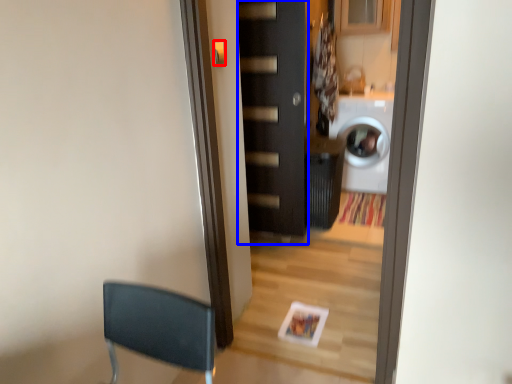
Question: Which point is closer to the camera, door handle (highlighted by a red box) or door (highlighted by a blue box)?

Choices:
 (A) door handle
 (B) door

Answer: (A)